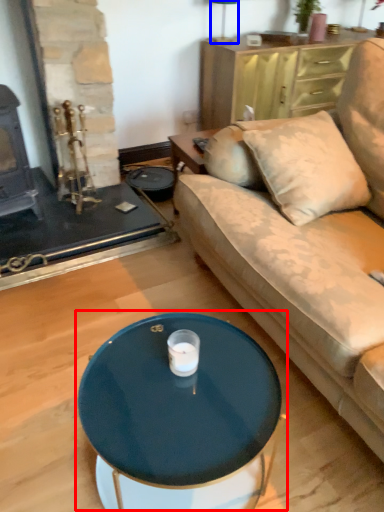
Question: Which point is closer to the camera, coffee table (highlighted by a red box) or lamp (highlighted by a blue box)?

Choices:
 (A) coffee table
 (B) lamp

Answer: (A)